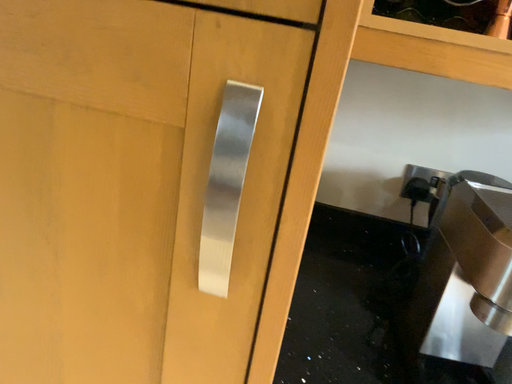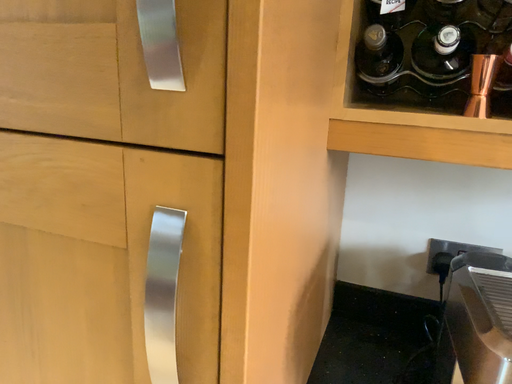
Question: Which way did the camera rotate in the video?

Choices:
 (A) rotated upward
 (B) rotated downward

Answer: (A)